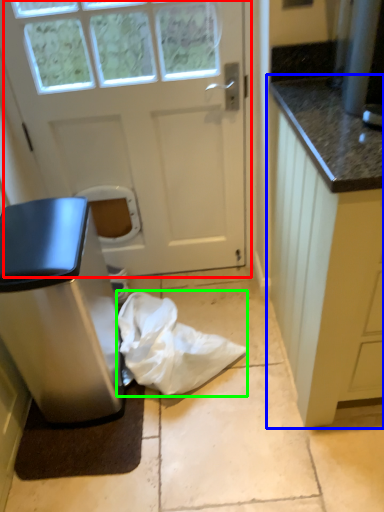
Question: Considering the real-world distances, which object is farthest from door (highlighted by a red box)? cabinetry (highlighted by a blue box) or material (highlighted by a green box)?

Choices:
 (A) cabinetry
 (B) material

Answer: (A)